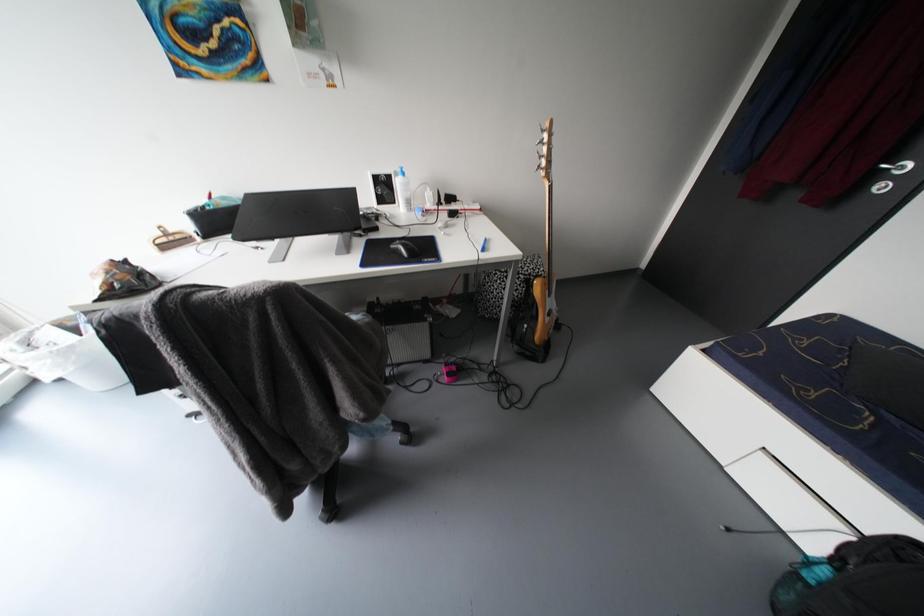
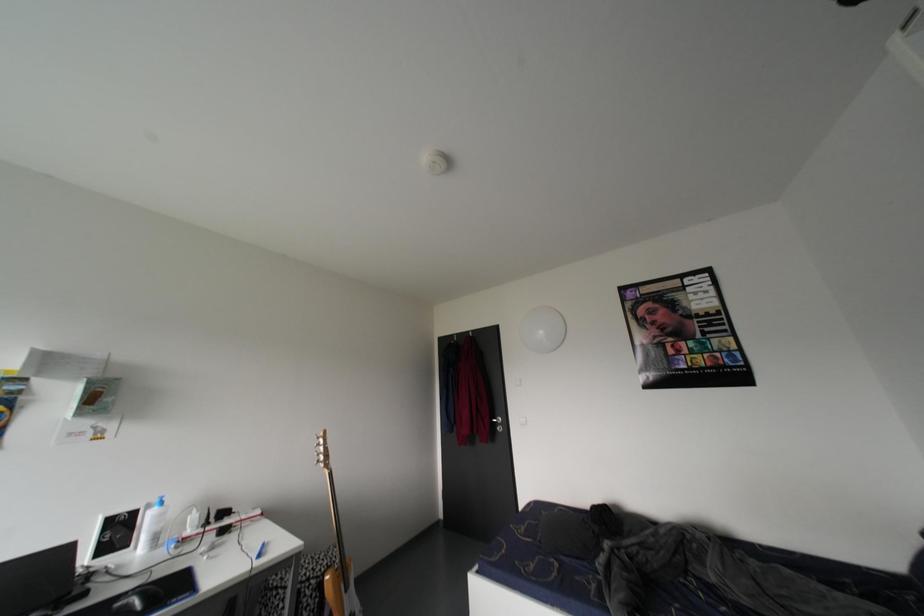
First-person continuous shooting, in which direction is the camera rotating?

The rotation direction of the camera is right-up.